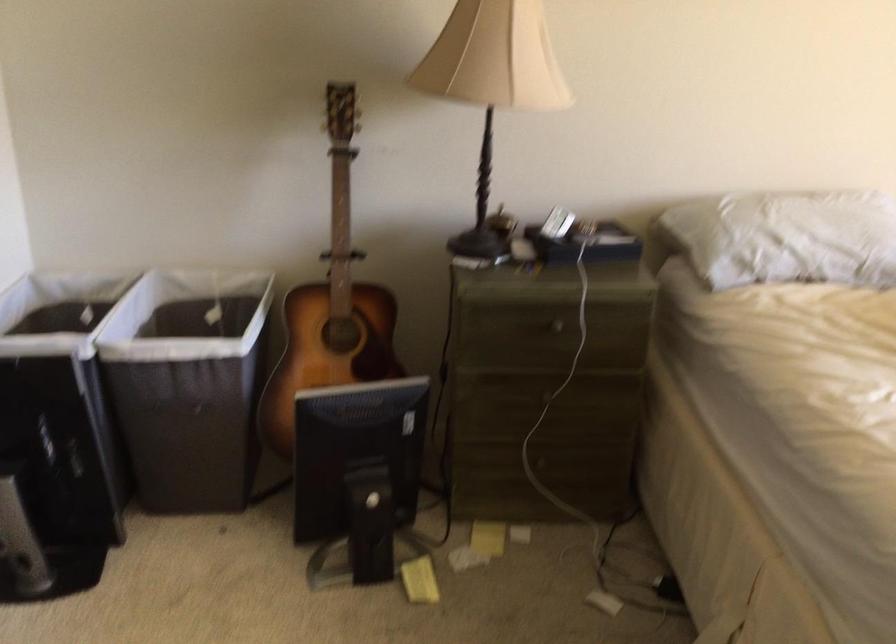
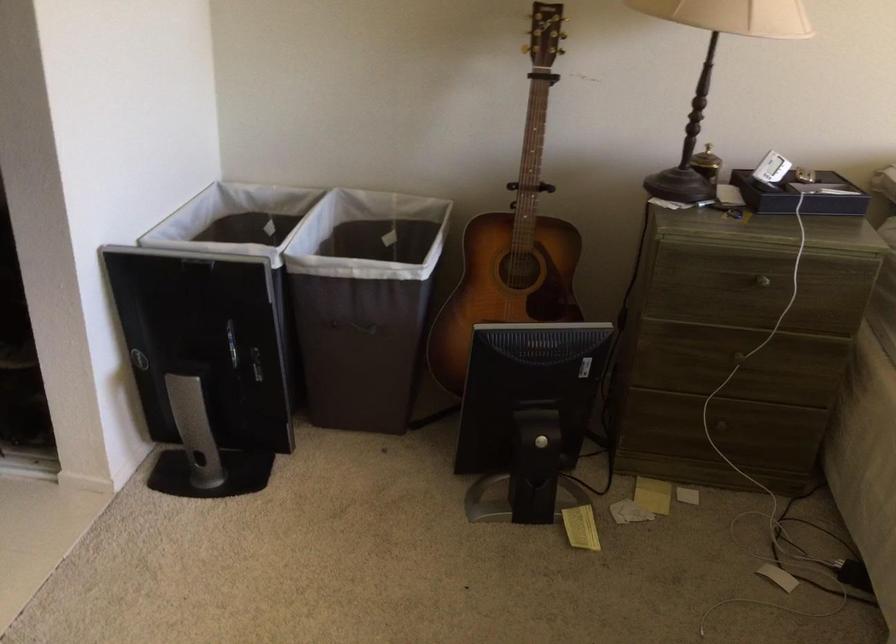
Where in the second image is the point corresponding to (364,476) from the first image?

(528, 415)